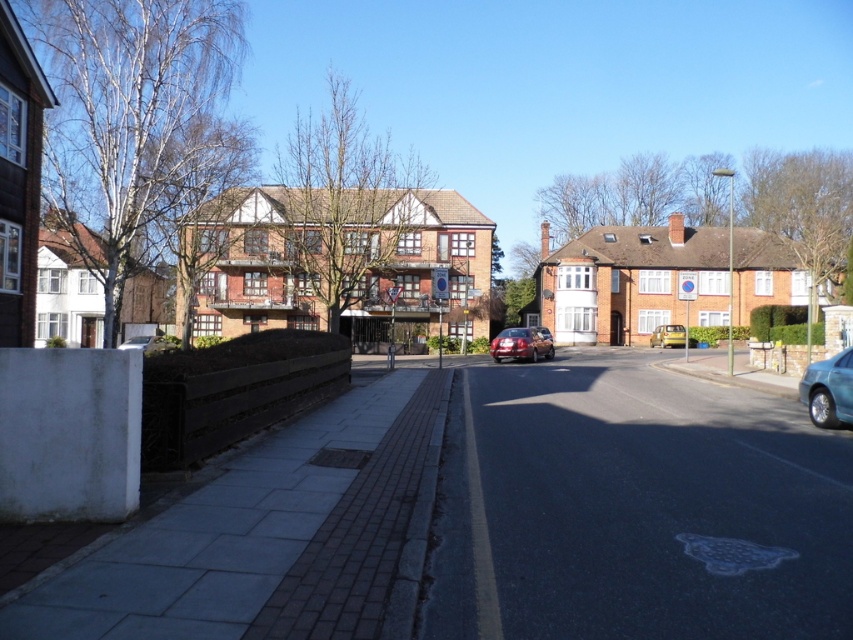
Question: Estimate the real-world distances between objects in this image. Which object is farther from the matte silver car at lower left?

Choices:
 (A) satin red sedan at center
 (B) teal glossy sedan at right

Answer: (B)

Question: Is teal glossy sedan at right below yellow matte van at center?

Choices:
 (A) no
 (B) yes

Answer: (B)

Question: Estimate the real-world distances between objects in this image. Which object is farther from the teal glossy sedan at right?

Choices:
 (A) yellow matte van at center
 (B) satin red sedan at center
 (C) matte silver car at lower left

Answer: (C)

Question: Which point is farther to the camera?

Choices:
 (A) (520, 332)
 (B) (669, 339)

Answer: (B)

Question: Does yellow matte van at center have a lesser width compared to matte silver car at lower left?

Choices:
 (A) yes
 (B) no

Answer: (A)

Question: Can you confirm if satin red sedan at center is positioned to the right of matte silver car at lower left?

Choices:
 (A) no
 (B) yes

Answer: (B)